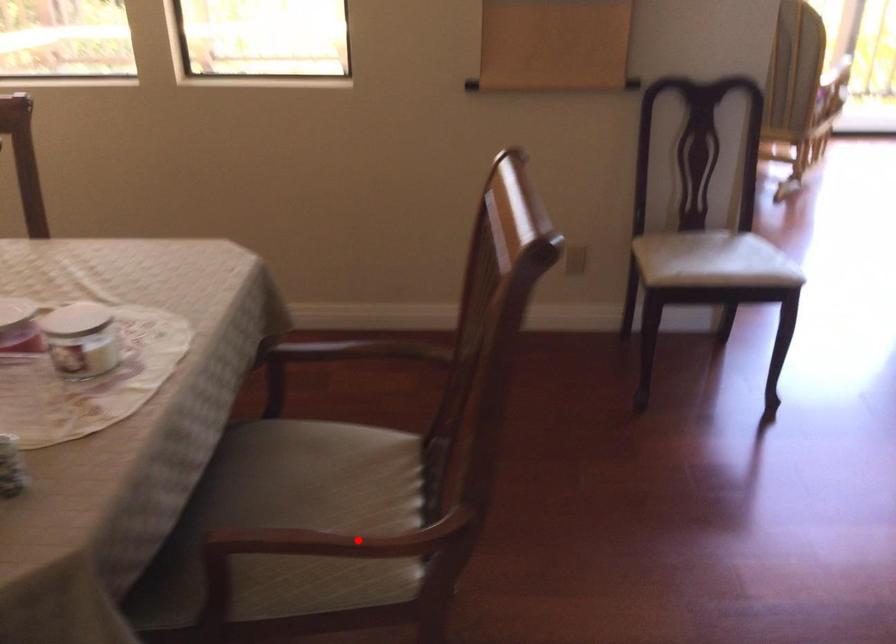
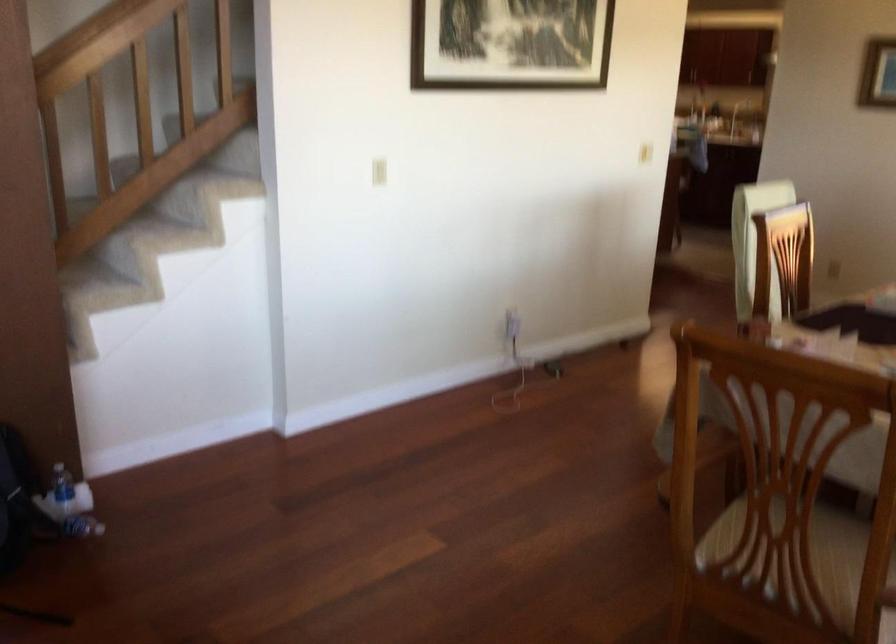
Question: A red point is marked in image1. In image2, is the corresponding 3D point closer to the camera or farther? Reply with the corresponding letter.

Choices:
 (A) The corresponding 3D point is closer.
 (B) The corresponding 3D point is farther.

Answer: (B)